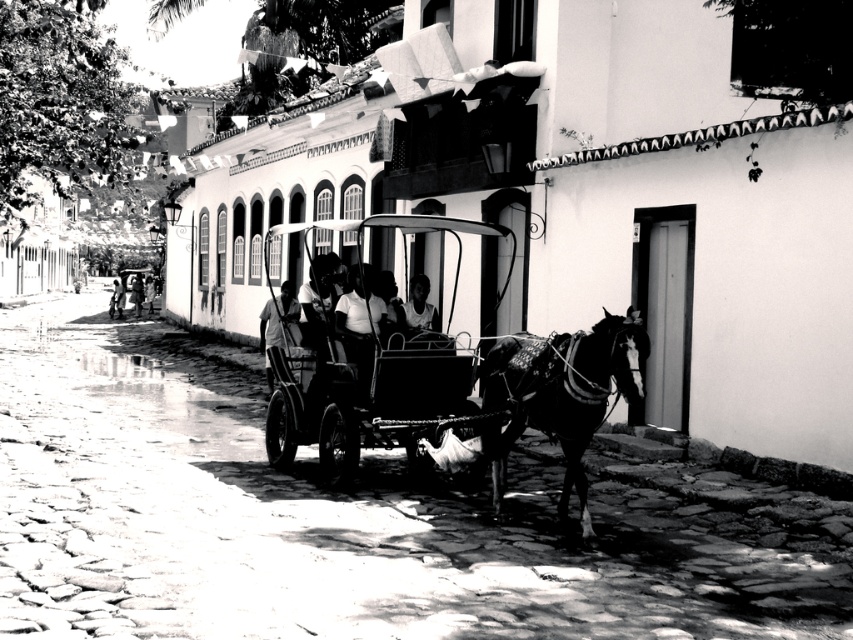
Is metallic cart at center above shiny black horse at center?

Yes, metallic cart at center is above shiny black horse at center.

Which of these two, metallic cart at center or shiny black horse at center, stands taller?

Standing taller between the two is metallic cart at center.

At what (x,y) coordinates should I click in order to perform the action: click on metallic cart at center. Please return your answer as a coordinate pair (x, y). Image resolution: width=853 pixels, height=640 pixels. Looking at the image, I should click on (364, 388).

In order to click on metallic cart at center in this screenshot , I will do `click(364, 388)`.

Does metallic cart at center appear on the left side of smooth skin person at center?

No, metallic cart at center is not to the left of smooth skin person at center.

Can you confirm if metallic cart at center is smaller than smooth skin person at center?

Correct, metallic cart at center occupies less space than smooth skin person at center.

What do you see at coordinates (364, 388) in the screenshot? This screenshot has height=640, width=853. I see `metallic cart at center` at bounding box center [364, 388].

Image resolution: width=853 pixels, height=640 pixels. Find the location of `metallic cart at center`. metallic cart at center is located at coordinates (364, 388).

Is point (560, 499) positioned after point (428, 316)?

No, it is in front of (428, 316).

Who is higher up, shiny black horse at center or smooth skin face at center?

smooth skin face at center

Does point (563, 480) lie in front of point (413, 294)?

Yes, it is.

Identify the location of shiny black horse at center. (560, 396).